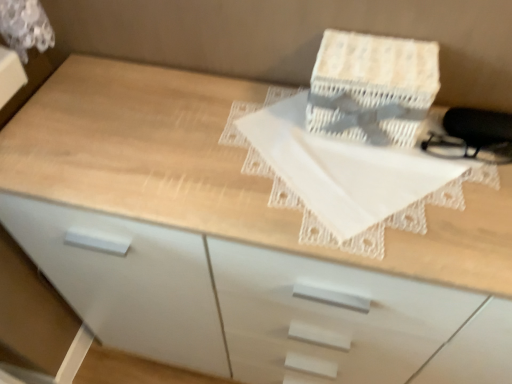
Locate an element on the screen. Image resolution: width=512 pixels, height=384 pixels. free point above white lace cloth at center (from a real-world perspective) is located at coordinates (351, 170).